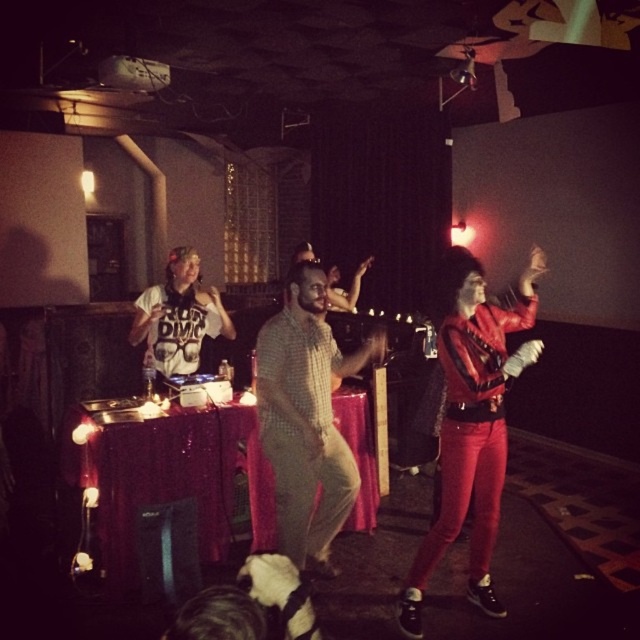
Does point (150, 449) come behind point (150, 301)?

No, it is in front of (150, 301).

Between point (212, 500) and point (168, 353), which one is positioned in front?

Positioned in front is point (212, 500).

Where is `shiny red tablecloth at center`? shiny red tablecloth at center is located at coordinates coord(172,481).

Does shiny red tablecloth at center have a lesser height compared to shiny red leather jacket at right?

Yes.

Does shiny red tablecloth at center come behind shiny red leather jacket at right?

Yes, it is behind shiny red leather jacket at right.

Where is `shiny red tablecloth at center`? The image size is (640, 640). shiny red tablecloth at center is located at coordinates click(x=172, y=481).

How distant is shiny red leather jacket at right from matte black t-shirt at center?

A distance of 5.73 feet exists between shiny red leather jacket at right and matte black t-shirt at center.

Does shiny red leather jacket at right appear on the right side of matte black t-shirt at center?

Indeed, shiny red leather jacket at right is positioned on the right side of matte black t-shirt at center.

Which is in front, point (472, 336) or point (168, 307)?

Point (472, 336) is more forward.

Locate an element on the screen. The image size is (640, 640). shiny red leather jacket at right is located at coordinates (472, 433).